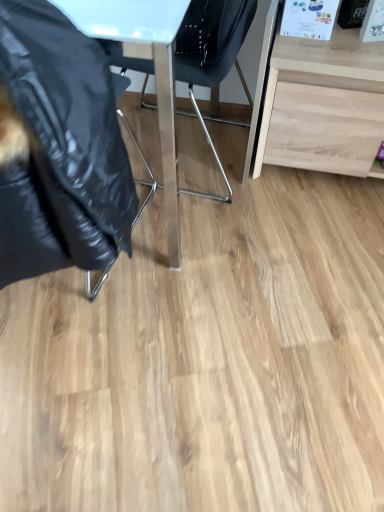
Question: From a real-world perspective, does black glossy jacket at left, which ranks as the 2th chair in right-to-left order, sit lower than metallic blue chair at center, placed as the first chair when sorted from right to left?

Choices:
 (A) yes
 (B) no

Answer: (B)

Question: Can you confirm if black glossy jacket at left, the first chair in the left-to-right sequence, is shorter than metallic blue chair at center, placed as the first chair when sorted from right to left?

Choices:
 (A) yes
 (B) no

Answer: (B)

Question: Is black glossy jacket at left, the first chair in the left-to-right sequence, bigger than metallic blue chair at center, placed as the first chair when sorted from right to left?

Choices:
 (A) yes
 (B) no

Answer: (B)

Question: Can you confirm if black glossy jacket at left, which ranks as the 2th chair in right-to-left order, is smaller than metallic blue chair at center, placed as the first chair when sorted from right to left?

Choices:
 (A) yes
 (B) no

Answer: (A)

Question: Is black glossy jacket at left, the first chair in the left-to-right sequence, looking in the opposite direction of metallic blue chair at center, arranged as the second chair when viewed from the left?

Choices:
 (A) no
 (B) yes

Answer: (A)

Question: Based on their positions, is black glossy jacket at left, which ranks as the 2th chair in right-to-left order, located to the left or right of light wood desk at right?

Choices:
 (A) right
 (B) left

Answer: (B)

Question: From the image's perspective, is black glossy jacket at left, the first chair in the left-to-right sequence, positioned above or below light wood desk at right?

Choices:
 (A) below
 (B) above

Answer: (A)

Question: In terms of height, does black glossy jacket at left, which ranks as the 2th chair in right-to-left order, look taller or shorter compared to light wood desk at right?

Choices:
 (A) tall
 (B) short

Answer: (A)

Question: Would you say black glossy jacket at left, which ranks as the 2th chair in right-to-left order, is inside or outside light wood desk at right?

Choices:
 (A) outside
 (B) inside

Answer: (A)

Question: Based on their positions, is light wood desk at right located to the left or right of metallic blue chair at center, placed as the first chair when sorted from right to left?

Choices:
 (A) right
 (B) left

Answer: (A)

Question: Is light wood desk at right inside the boundaries of metallic blue chair at center, placed as the first chair when sorted from right to left, or outside?

Choices:
 (A) inside
 (B) outside

Answer: (B)

Question: From a real-world perspective, relative to metallic blue chair at center, placed as the first chair when sorted from right to left, is light wood desk at right vertically above or below?

Choices:
 (A) above
 (B) below

Answer: (B)

Question: From the image's perspective, is light wood desk at right located above or below metallic blue chair at center, placed as the first chair when sorted from right to left?

Choices:
 (A) below
 (B) above

Answer: (A)

Question: From a real-world perspective, is light wood desk at right physically located above or below black glossy jacket at left, which ranks as the 2th chair in right-to-left order?

Choices:
 (A) above
 (B) below

Answer: (B)

Question: In terms of height, does light wood desk at right look taller or shorter compared to black glossy jacket at left, which ranks as the 2th chair in right-to-left order?

Choices:
 (A) tall
 (B) short

Answer: (B)